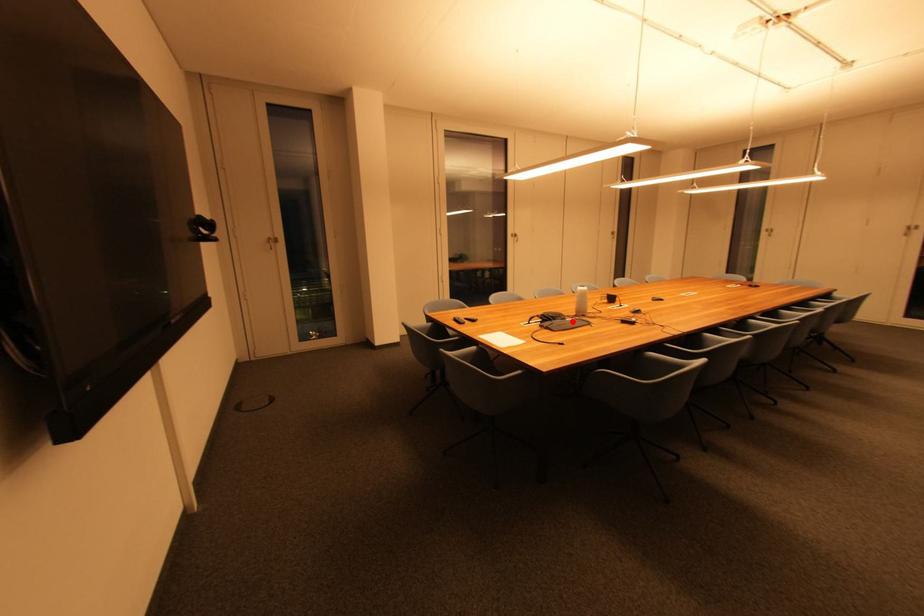
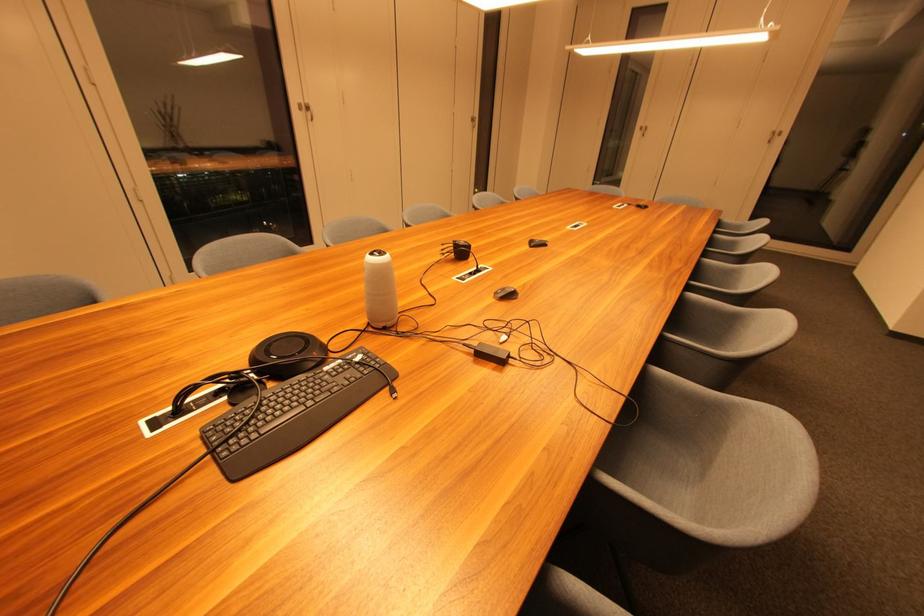
Find the pixel in the second image that matches the highlighted location in the first image.

(332, 371)